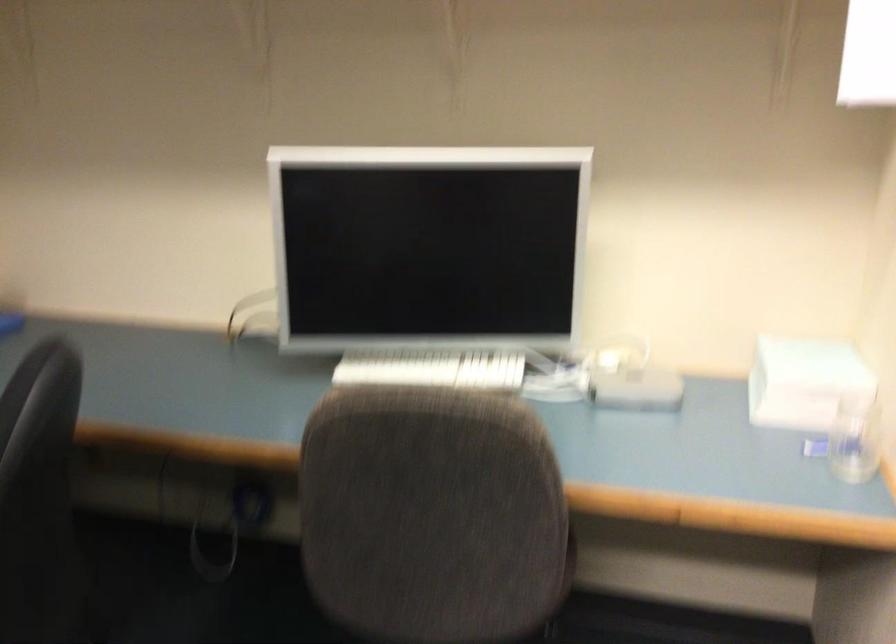
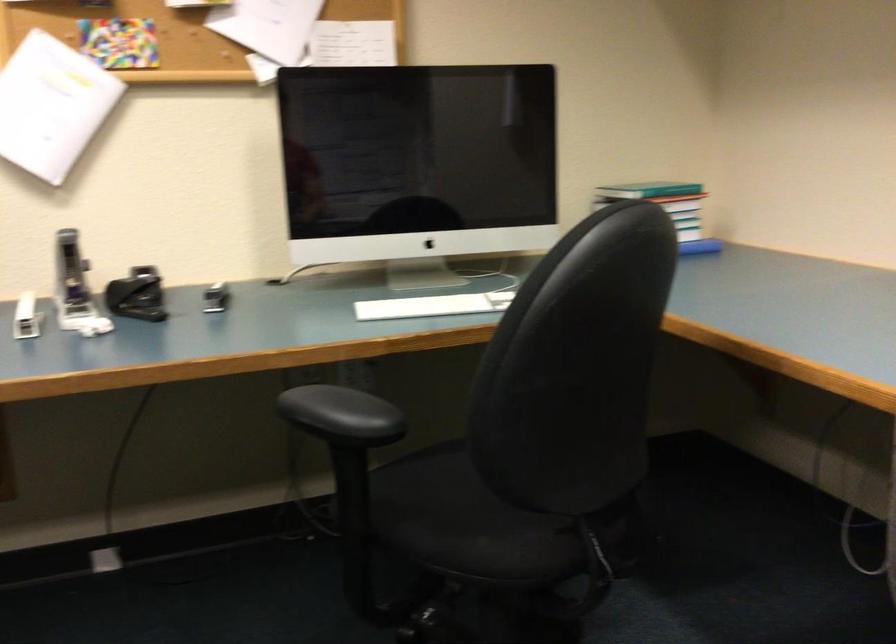
Question: The first image is from the beginning of the video and the second image is from the end. How did the camera likely rotate when shooting the video?

Choices:
 (A) Left
 (B) Right
 (C) Up
 (D) Down

Answer: (A)